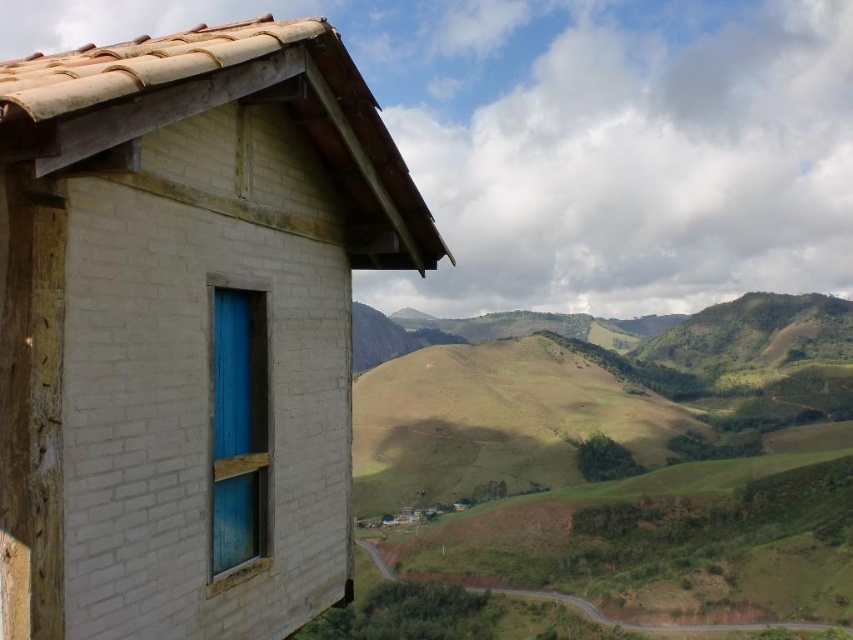
Question: Which of the following is the farthest from the observer?

Choices:
 (A) blue painted wood window at center
 (B) white brick hut at upper left

Answer: (A)

Question: Does white brick hut at upper left have a lesser width compared to blue painted wood window at center?

Choices:
 (A) no
 (B) yes

Answer: (A)

Question: Does white brick hut at upper left appear on the right side of blue painted wood window at center?

Choices:
 (A) yes
 (B) no

Answer: (B)

Question: Which point is farther to the camera?

Choices:
 (A) white brick hut at upper left
 (B) blue painted wood window at center

Answer: (B)

Question: Does white brick hut at upper left come behind blue painted wood window at center?

Choices:
 (A) no
 (B) yes

Answer: (A)